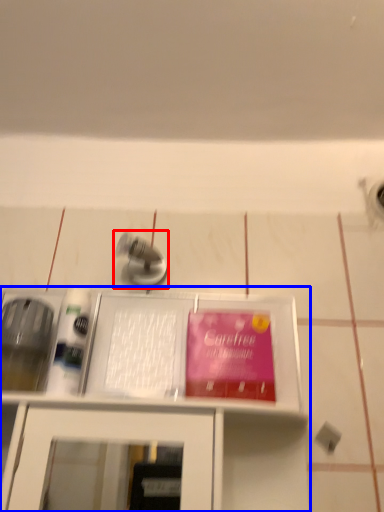
Question: Which object appears farthest to the camera in this image, tap (highlighted by a red box) or furniture (highlighted by a blue box)?

Choices:
 (A) tap
 (B) furniture

Answer: (A)